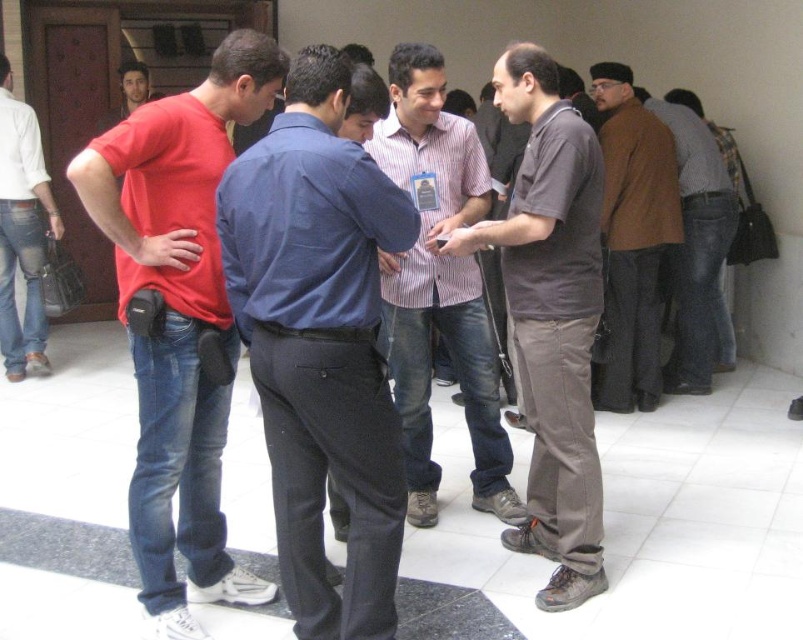
Question: Which object is closer to the camera taking this photo?

Choices:
 (A) matte red t-shirt at left
 (B) matte gray shirt at center
 (C) brown leather jacket at right

Answer: (A)

Question: Can you confirm if blue shirt at center is bigger than matte red t-shirt at left?

Choices:
 (A) no
 (B) yes

Answer: (A)

Question: Which is nearer to the blue shirt at center?

Choices:
 (A) brown woolen sweater at right
 (B) jeans at left

Answer: (A)

Question: Does striped cotton shirt at center have a greater width compared to brown woolen sweater at right?

Choices:
 (A) no
 (B) yes

Answer: (B)

Question: Among these points, which one is nearest to the camera?

Choices:
 (A) (406, 452)
 (B) (559, 378)

Answer: (B)

Question: From the image, what is the correct spatial relationship of matte gray shirt at center in relation to brown woolen sweater at right?

Choices:
 (A) left
 (B) right

Answer: (A)